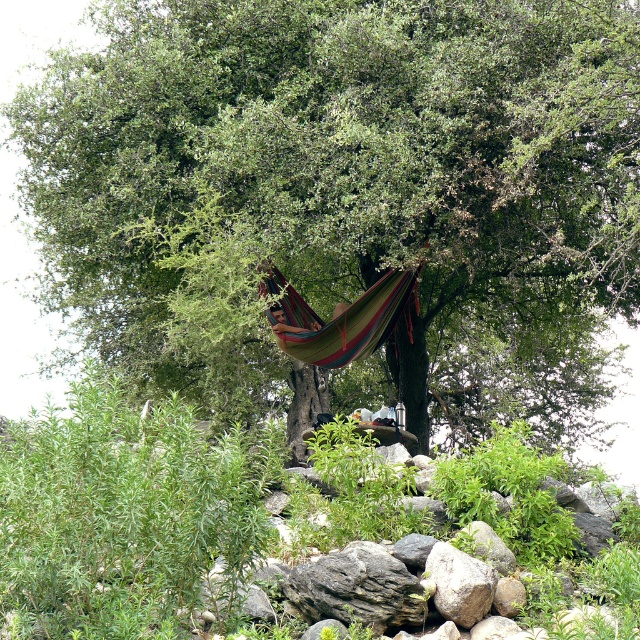
Question: Does green leafy tree at center have a smaller size compared to gray rock at center?

Choices:
 (A) no
 (B) yes

Answer: (A)

Question: Which object appears closest to the camera in this image?

Choices:
 (A) gray rock at center
 (B) multicolored fabric hammock at center
 (C) green leafy tree at center

Answer: (A)

Question: Does multicolored fabric hammock at center appear on the right side of gray rock at center?

Choices:
 (A) no
 (B) yes

Answer: (A)

Question: Which of the following is the farthest from the observer?

Choices:
 (A) (634, 88)
 (B) (385, 294)

Answer: (B)

Question: Which point is closer to the camera?

Choices:
 (A) gray rock at center
 (B) green leafy tree at center
 (C) multicolored fabric hammock at center

Answer: (A)

Question: Does multicolored fabric hammock at center lie behind gray rock at center?

Choices:
 (A) yes
 (B) no

Answer: (A)